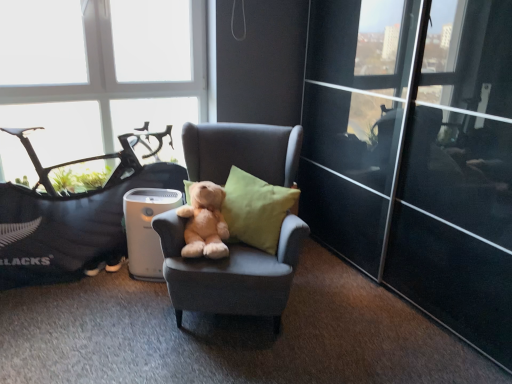
Measure the distance between point (x=265, y=194) and camera.

They are 7.92 feet apart.

Describe the element at coordinates (419, 166) in the screenshot. This screenshot has height=384, width=512. I see `transparent glass door at right` at that location.

The width and height of the screenshot is (512, 384). Identify the location of matte gray armchair at center. (230, 273).

Considering the sizes of objects transparent glass window at upper left and linen green pillow at center in the image provided, who is smaller, transparent glass window at upper left or linen green pillow at center?

linen green pillow at center is smaller.

Which point is more distant from viewer, (194, 92) or (233, 167)?

Positioned behind is point (194, 92).

From a real-world perspective, is transparent glass window at upper left above or below linen green pillow at center?

transparent glass window at upper left is situated higher than linen green pillow at center in the real world.

Does matte gray armchair at center come behind transparent glass window at upper left?

That is False.

Can we say matte gray armchair at center lies outside transparent glass window at upper left?

matte gray armchair at center is positioned outside transparent glass window at upper left.

Where is `chair located on the right of transparent glass window at upper left`? The width and height of the screenshot is (512, 384). chair located on the right of transparent glass window at upper left is located at coordinates (230, 273).

Relative to transparent glass door at right, is linen green pillow at center in front or behind?

Clearly, linen green pillow at center is behind transparent glass door at right.

Is linen green pillow at center next to transparent glass door at right?

linen green pillow at center and transparent glass door at right are not in contact.

How different are the orientations of linen green pillow at center and transparent glass door at right in degrees?

43.3 degrees.

Consider the image. From the image's perspective, is soft gray bean bag chair at left positioned above or below linen green pillow at center?

Based on their image positions, soft gray bean bag chair at left is located above linen green pillow at center.

The image size is (512, 384). I want to click on bean bag chair lying above the linen green pillow at center (from the image's perspective), so click(72, 217).

Are soft gray bean bag chair at left and linen green pillow at center located far from each other?

They are positioned close to each other.

From a real-world perspective, who is located lower, soft gray bean bag chair at left or linen green pillow at center?

soft gray bean bag chair at left, from a real-world perspective.

Which of these two, transparent glass door at right or transparent glass window at upper left, is smaller?

transparent glass window at upper left.

Do you think transparent glass door at right is within transparent glass window at upper left, or outside of it?

transparent glass door at right is not enclosed by transparent glass window at upper left.

Is point (413, 296) positioned in front of point (71, 28)?

Yes, it is in front of point (71, 28).

How many degrees apart are the facing directions of transparent glass door at right and transparent glass window at upper left?

The angular difference between transparent glass door at right and transparent glass window at upper left is 89.9 degrees.

From the image's perspective, would you say soft gray bean bag chair at left is positioned over transparent glass window at upper left?

No, from the image's perspective, soft gray bean bag chair at left is not on top of transparent glass window at upper left.

This screenshot has height=384, width=512. I want to click on window located above the soft gray bean bag chair at left (from a real-world perspective), so click(101, 73).

From a real-world perspective, is soft gray bean bag chair at left below transparent glass window at upper left?

Indeed, from a real-world perspective, soft gray bean bag chair at left is positioned beneath transparent glass window at upper left.

Is soft gray bean bag chair at left situated inside transparent glass window at upper left or outside?

soft gray bean bag chair at left is not inside transparent glass window at upper left, it's outside.

Is soft gray bean bag chair at left completely or partially outside of matte gray armchair at center?

soft gray bean bag chair at left lies outside matte gray armchair at center's area.

Is soft gray bean bag chair at left bigger than matte gray armchair at center?

Incorrect, soft gray bean bag chair at left is not larger than matte gray armchair at center.

From a real-world perspective, is soft gray bean bag chair at left above or below matte gray armchair at center?

In terms of real-world spatial position, soft gray bean bag chair at left is below matte gray armchair at center.

Find the location of a particular element. window lying above the linen green pillow at center (from the image's perspective) is located at coordinates (x=101, y=73).

Image resolution: width=512 pixels, height=384 pixels. In order to click on chair that is under the transparent glass window at upper left (from a real-world perspective) in this screenshot , I will do `click(230, 273)`.

From the picture: Looking at the image, which one is located closer to transparent glass window at upper left, linen green pillow at center or matte gray armchair at center?

linen green pillow at center is positioned closer to the anchor transparent glass window at upper left.

Looking at the image, which one is located closer to soft gray bean bag chair at left, soft plush teddy bear at center or linen green pillow at center?

Among the two, soft plush teddy bear at center is located nearer to soft gray bean bag chair at left.

Looking at the image, which one is located further to transparent glass window at upper left, soft plush teddy bear at center or matte gray armchair at center?

Based on the image, matte gray armchair at center appears to be further to transparent glass window at upper left.

Which object lies nearer to the anchor point transparent glass door at right, soft plush teddy bear at center or matte gray armchair at center?

matte gray armchair at center lies closer to transparent glass door at right than the other object.

Which object lies nearer to the anchor point transparent glass door at right, transparent glass window at upper left or soft plush teddy bear at center?

soft plush teddy bear at center is positioned closer to the anchor transparent glass door at right.

Which object lies nearer to the anchor point matte gray armchair at center, soft gray bean bag chair at left or transparent glass door at right?

soft gray bean bag chair at left.

Which object lies nearer to the anchor point soft gray bean bag chair at left, soft plush teddy bear at center or transparent glass window at upper left?

transparent glass window at upper left.

From the image, which object appears to be nearer to transparent glass door at right, soft gray bean bag chair at left or matte gray armchair at center?

Based on the image, matte gray armchair at center appears to be nearer to transparent glass door at right.

Where is `chair situated between transparent glass window at upper left and transparent glass door at right from left to right`? The image size is (512, 384). chair situated between transparent glass window at upper left and transparent glass door at right from left to right is located at coordinates (230, 273).

The height and width of the screenshot is (384, 512). I want to click on pillow between soft gray bean bag chair at left and transparent glass door at right in the horizontal direction, so click(256, 209).

Where is `chair located between soft gray bean bag chair at left and transparent glass door at right in the left-right direction`? The height and width of the screenshot is (384, 512). chair located between soft gray bean bag chair at left and transparent glass door at right in the left-right direction is located at coordinates (230, 273).

Find the location of a particular element. pillow between transparent glass window at upper left and transparent glass door at right from left to right is located at coordinates (256, 209).